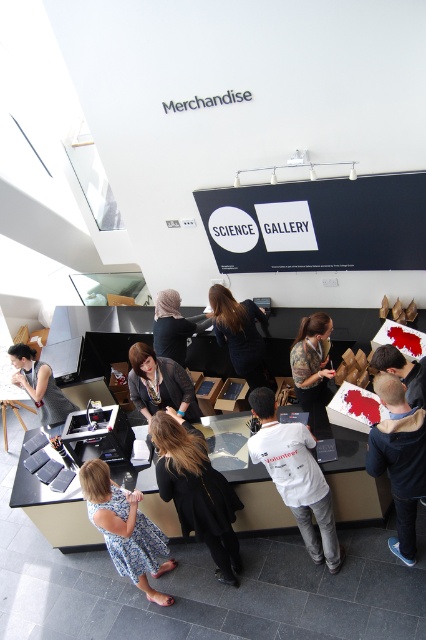
Measure the distance between black matte signboard at upper center and blue fleece jacket at lower right.

They are 7.24 feet apart.

Identify the location of black matte signboard at upper center. (317, 224).

Locate an element on the screen. black matte signboard at upper center is located at coordinates (317, 224).

Does black matte signboard at upper center appear over matte black jacket at center?

Yes.

Does point (233, 216) come closer to viewer compared to point (141, 403)?

No.

Which is in front, point (298, 220) or point (143, 413)?

Point (143, 413) is more forward.

Image resolution: width=426 pixels, height=640 pixels. I want to click on black matte signboard at upper center, so click(317, 224).

Locate an element on the screen. The width and height of the screenshot is (426, 640). dark blue dress at center is located at coordinates (241, 333).

Can you confirm if dark blue dress at center is positioned to the right of matte black laptop at lower left?

Correct, you'll find dark blue dress at center to the right of matte black laptop at lower left.

Identify the location of dark blue dress at center. The width and height of the screenshot is (426, 640). (241, 333).

Locate an element on the screen. This screenshot has height=640, width=426. dark blue dress at center is located at coordinates (241, 333).